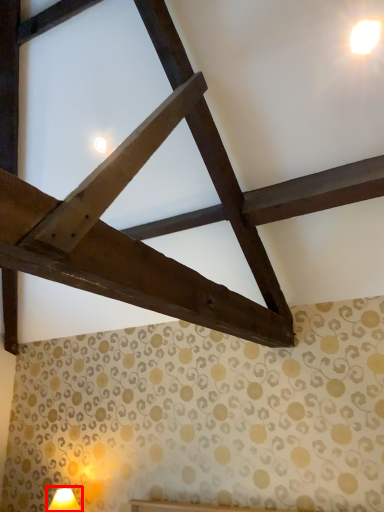
Question: From the image's perspective, considering the relative positions of table lamp (annotated by the red box) and light in the image provided, where is table lamp (annotated by the red box) located with respect to the staircase?

Choices:
 (A) below
 (B) above

Answer: (A)